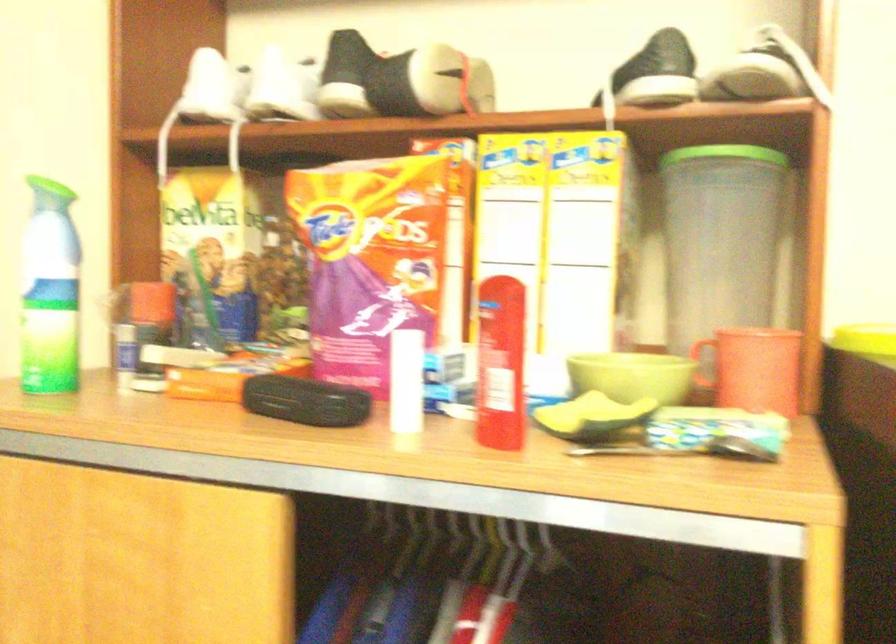
Find where to lift the canister green lid. Please return your answer as a coordinate pair (x, y).

(725, 153)